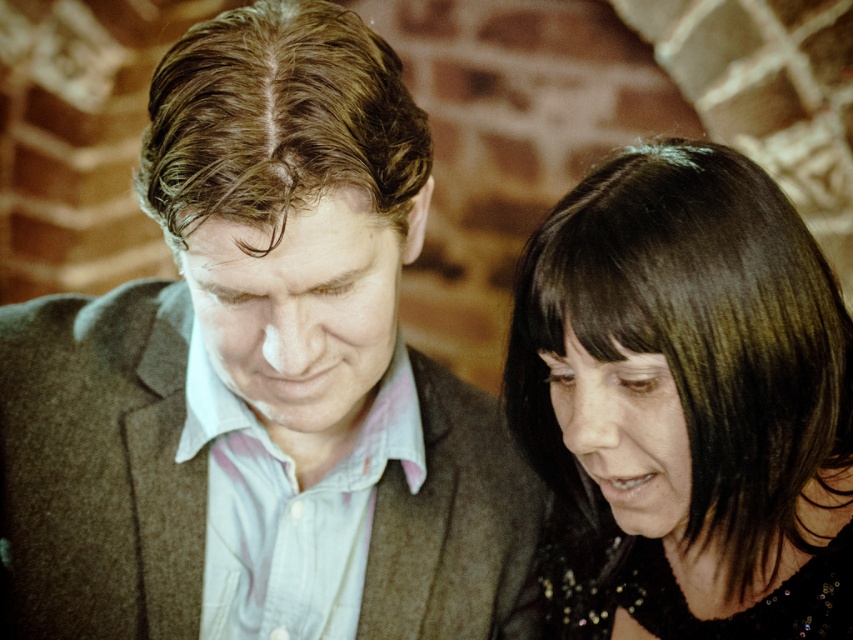
Question: Is brown woolen suit at center smaller than shiny black hair at center?

Choices:
 (A) yes
 (B) no

Answer: (B)

Question: Among these objects, which one is farthest from the camera?

Choices:
 (A) brown woolen suit at center
 (B) shiny black hair at center

Answer: (B)

Question: Can you confirm if brown woolen suit at center is thinner than shiny black hair at center?

Choices:
 (A) yes
 (B) no

Answer: (B)

Question: Can you confirm if brown woolen suit at center is thinner than shiny black hair at center?

Choices:
 (A) no
 (B) yes

Answer: (A)

Question: Which point is farther to the camera?

Choices:
 (A) brown woolen suit at center
 (B) shiny black hair at center

Answer: (B)